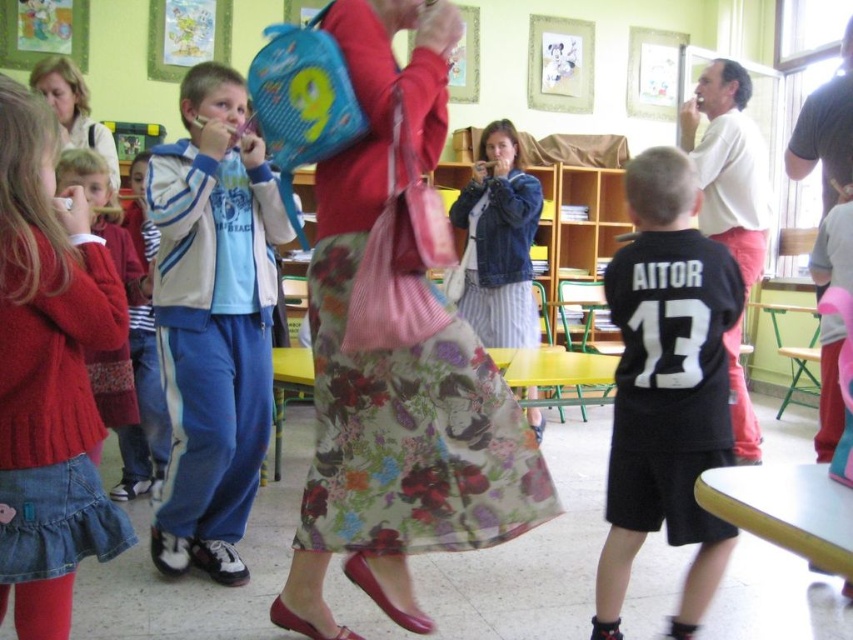
Which is behind, point (175, 321) or point (6, 93)?

The point (175, 321) is more distant.

Who is more forward, [254,365] or [54,420]?

Positioned in front is point [54,420].

Where is `blue track suit at left`? Image resolution: width=853 pixels, height=640 pixels. blue track suit at left is located at coordinates (213, 321).

You are a GUI agent. You are given a task and a screenshot of the screen. Output one action in this format:
    pyautogui.click(x=<x>, y=<y>)
    Task: Click on the blue track suit at left
    The width and height of the screenshot is (853, 640).
    Given the screenshot: What is the action you would take?
    pyautogui.click(x=213, y=321)

Does blue track suit at left have a lesser width compared to white cotton shirt at upper right?

Yes, blue track suit at left is thinner than white cotton shirt at upper right.

Is point (270, 252) closer to camera compared to point (730, 228)?

Yes, point (270, 252) is in front of point (730, 228).

Find the location of a particular element. The image size is (853, 640). blue track suit at left is located at coordinates (213, 321).

Does floral fabric skirt at center appear on the left side of black jersey at center?

Correct, you'll find floral fabric skirt at center to the left of black jersey at center.

Is floral fabric skirt at center bigger than black jersey at center?

Yes, floral fabric skirt at center is bigger than black jersey at center.

Locate an element on the screen. The height and width of the screenshot is (640, 853). floral fabric skirt at center is located at coordinates (397, 365).